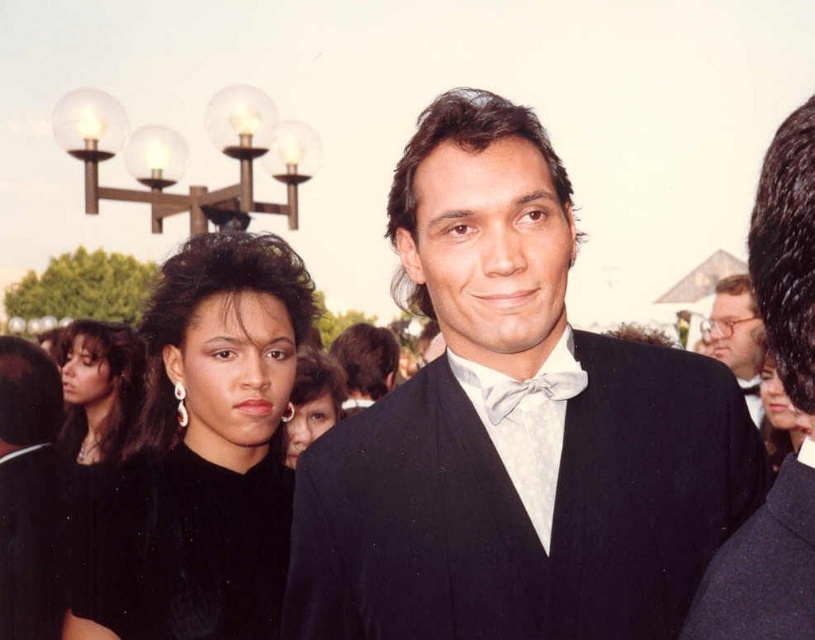
Question: Which point appears closest to the camera in this image?

Choices:
 (A) (774, 392)
 (B) (137, 356)

Answer: (A)

Question: Does shiny black suit at center appear under white satin bow tie at center?

Choices:
 (A) no
 (B) yes

Answer: (A)

Question: Which object appears farthest from the camera in this image?

Choices:
 (A) shiny black suit at center
 (B) smooth black dress at center
 (C) black satin suit at center
 (D) black matte dress at left

Answer: (B)

Question: Which of the following is the closest to the observer?

Choices:
 (A) (91, 369)
 (B) (316, 404)
 (C) (276, 508)
 (D) (769, 420)

Answer: (C)

Question: Can you confirm if black matte dress at left is thinner than navy wool business suit at right?

Choices:
 (A) no
 (B) yes

Answer: (A)

Question: In this image, where is matte black dress at center located relative to white satin bow tie at center?

Choices:
 (A) below
 (B) above

Answer: (A)